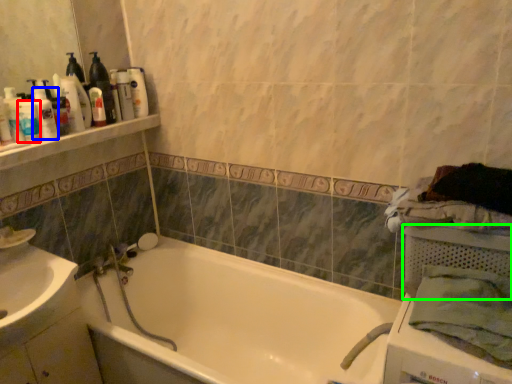
Question: Considering the real-world distances, which object is farthest from toiletry (highlighted by a red box)? toiletry (highlighted by a blue box) or basket (highlighted by a green box)?

Choices:
 (A) toiletry
 (B) basket

Answer: (B)